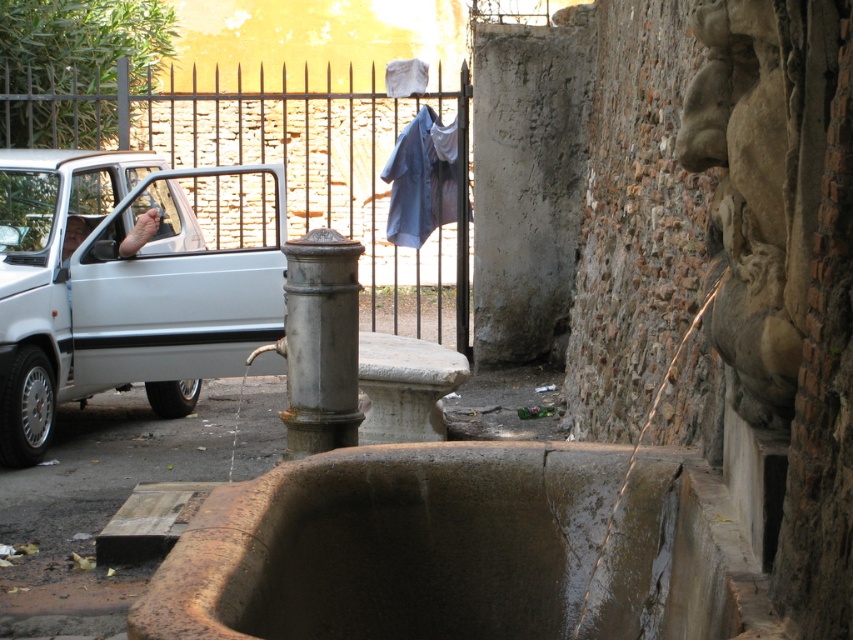
Between white matte car at left and blue fabric at center, which one is positioned higher?

white matte car at left is above.

How distant is white matte car at left from blue fabric at center?

white matte car at left is 5.80 meters from blue fabric at center.

What do you see at coordinates (128, 282) in the screenshot? I see `white matte car at left` at bounding box center [128, 282].

Where is `white matte car at left`? Image resolution: width=853 pixels, height=640 pixels. white matte car at left is located at coordinates (128, 282).

How much distance is there between white matte car at left and silver metallic pillar at center?

38.55 feet

Which is behind, point (28, 200) or point (311, 282)?

Point (28, 200)

Between point (254, 188) and point (299, 400), which one is positioned in front?

Positioned in front is point (299, 400).

You are a GUI agent. You are given a task and a screenshot of the screen. Output one action in this format:
    pyautogui.click(x=<x>, y=<y>)
    Task: Click on the white matte car at left
    The width and height of the screenshot is (853, 640).
    Given the screenshot: What is the action you would take?
    pyautogui.click(x=128, y=282)

Is metallic iron gate at upper center further to camera compared to blue fabric at center?

Yes, it is behind blue fabric at center.

Does metallic iron gate at upper center have a larger size compared to blue fabric at center?

No.

Which is behind, point (364, 240) or point (408, 216)?

Point (364, 240)

This screenshot has height=640, width=853. Find the location of `metallic iron gate at upper center`. metallic iron gate at upper center is located at coordinates (285, 168).